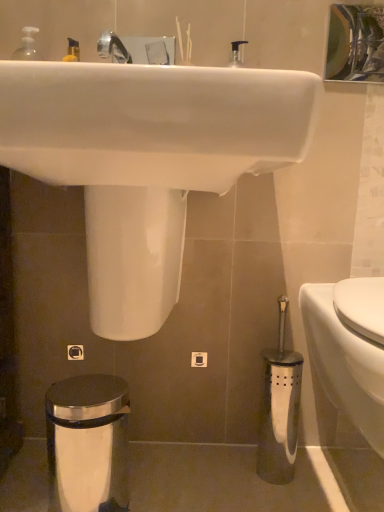
Question: From a real-world perspective, is satin chrome trash can at lower left physically above metallic reflective mirror at upper center?

Choices:
 (A) no
 (B) yes

Answer: (A)

Question: From the image's perspective, is satin chrome trash can at lower left located beneath metallic reflective mirror at upper center?

Choices:
 (A) yes
 (B) no

Answer: (A)

Question: Can you confirm if satin chrome trash can at lower left is smaller than metallic reflective mirror at upper center?

Choices:
 (A) no
 (B) yes

Answer: (A)

Question: Is the depth of satin chrome trash can at lower left less than that of metallic reflective mirror at upper center?

Choices:
 (A) no
 (B) yes

Answer: (B)

Question: Is satin chrome trash can at lower left touching metallic reflective mirror at upper center?

Choices:
 (A) yes
 (B) no

Answer: (B)

Question: From a real-world perspective, is white glossy sink at upper center physically located above or below metallic silver toilet brush at lower right?

Choices:
 (A) below
 (B) above

Answer: (B)

Question: In the image, is white glossy sink at upper center positioned in front of or behind metallic silver toilet brush at lower right?

Choices:
 (A) behind
 (B) front

Answer: (B)

Question: From the image's perspective, is white glossy sink at upper center located above or below metallic silver toilet brush at lower right?

Choices:
 (A) above
 (B) below

Answer: (A)

Question: From their relative heights in the image, would you say white glossy sink at upper center is taller or shorter than metallic silver toilet brush at lower right?

Choices:
 (A) tall
 (B) short

Answer: (A)

Question: Looking at the image, does white glossy sink at upper center seem bigger or smaller compared to satin chrome trash can at lower left?

Choices:
 (A) big
 (B) small

Answer: (A)

Question: Is white glossy sink at upper center taller or shorter than satin chrome trash can at lower left?

Choices:
 (A) short
 (B) tall

Answer: (B)

Question: Considering the positions of white glossy sink at upper center and satin chrome trash can at lower left in the image, is white glossy sink at upper center wider or thinner than satin chrome trash can at lower left?

Choices:
 (A) thin
 (B) wide

Answer: (B)

Question: Would you say white glossy sink at upper center is to the left or to the right of satin chrome trash can at lower left in the picture?

Choices:
 (A) right
 (B) left

Answer: (A)

Question: Considering their positions, is metallic silver toilet brush at lower right located in front of or behind white glossy toilet at lower right?

Choices:
 (A) behind
 (B) front

Answer: (A)

Question: From a real-world perspective, is metallic silver toilet brush at lower right positioned above or below white glossy toilet at lower right?

Choices:
 (A) above
 (B) below

Answer: (B)